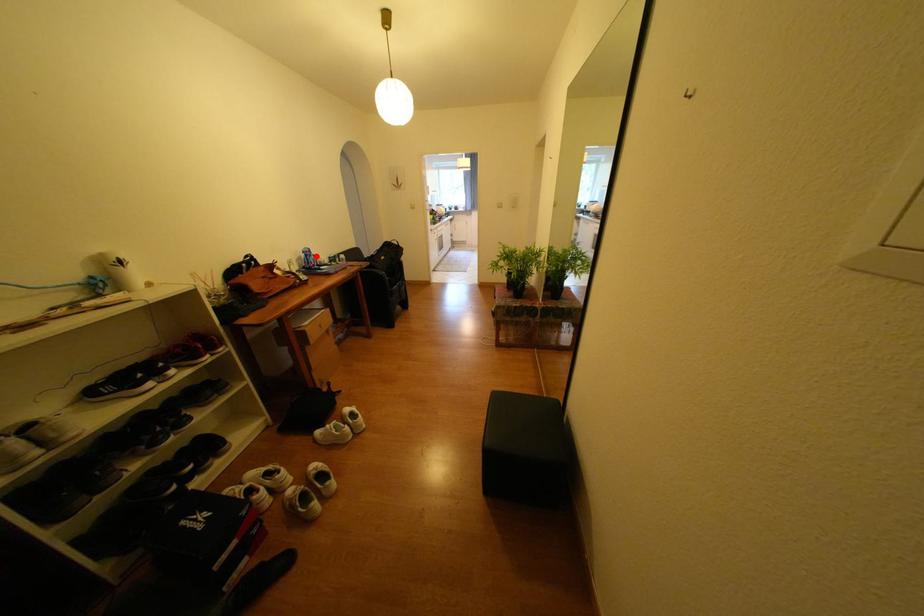
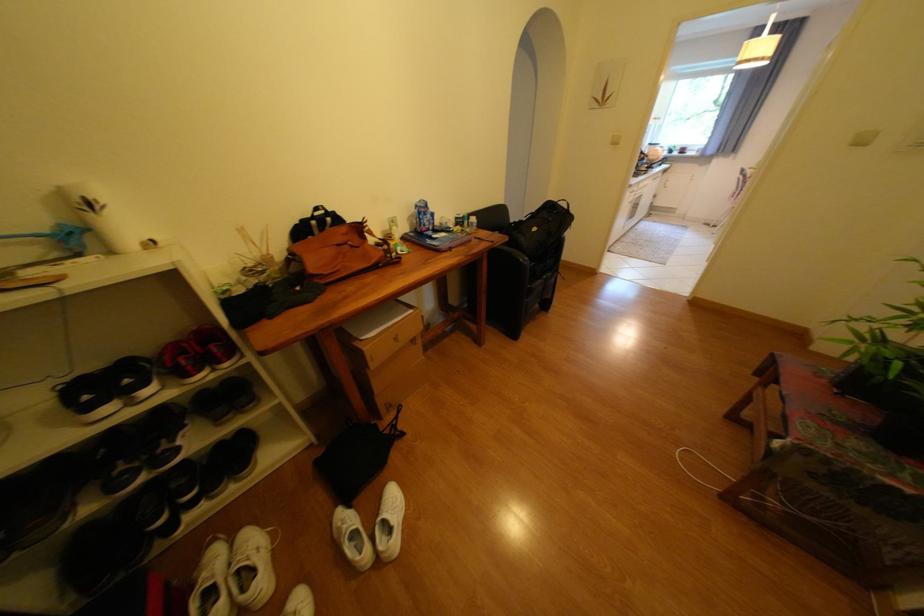
Where in the second image is the point corresponding to the highlighted location from the first image?

(429, 214)